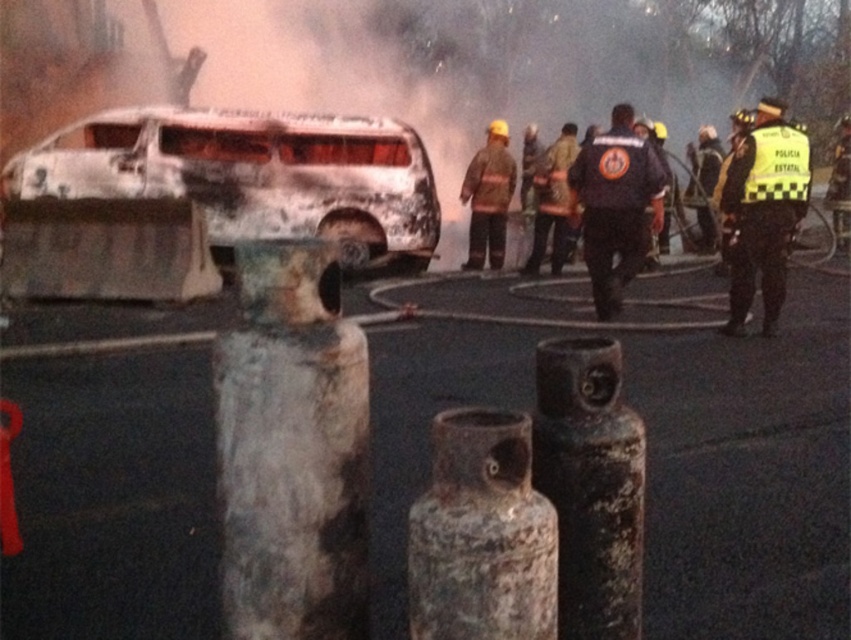
Question: Is yellow reflective vest at right thinner than yellow reflective vest at center?

Choices:
 (A) no
 (B) yes

Answer: (B)

Question: Which of the following is the farthest from the observer?

Choices:
 (A) pyautogui.click(x=478, y=234)
 (B) pyautogui.click(x=216, y=173)

Answer: (A)

Question: Does black uniform at center have a greater width compared to yellow reflective vest at center?

Choices:
 (A) no
 (B) yes

Answer: (A)

Question: Which point is farther to the camera?

Choices:
 (A) (581, 173)
 (B) (775, 198)
 (C) (698, 148)
 (D) (557, 268)

Answer: (C)

Question: Which of the following is the closest to the observer?

Choices:
 (A) yellow reflective vest at right
 (B) yellow reflective vest at center-right
 (C) yellow reflective vest at center
 (D) burnt metallic van at center

Answer: (A)

Question: Is fire-resistant uniform at center thinner than yellow reflective vest at center-right?

Choices:
 (A) yes
 (B) no

Answer: (B)